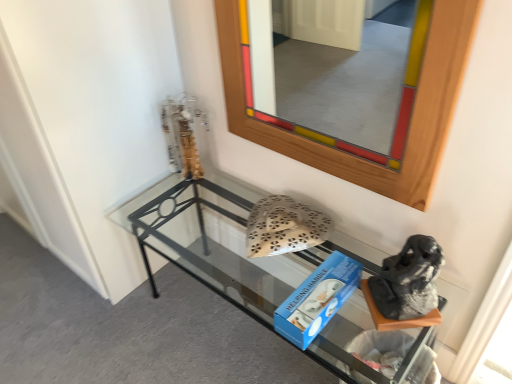
Question: Is gray fabric boot at lower right further to camera compared to clear glass shelf at lower center?

Choices:
 (A) yes
 (B) no

Answer: (A)

Question: Is gray fabric boot at lower right not close to clear glass shelf at lower center?

Choices:
 (A) yes
 (B) no

Answer: (B)

Question: Does gray fabric boot at lower right appear on the left side of clear glass shelf at lower center?

Choices:
 (A) no
 (B) yes

Answer: (A)

Question: Can you confirm if gray fabric boot at lower right is positioned to the right of clear glass shelf at lower center?

Choices:
 (A) yes
 (B) no

Answer: (A)

Question: From the image's perspective, is gray fabric boot at lower right below clear glass shelf at lower center?

Choices:
 (A) yes
 (B) no

Answer: (B)

Question: From a real-world perspective, is gray fabric boot at lower right positioned over clear glass shelf at lower center based on gravity?

Choices:
 (A) no
 (B) yes

Answer: (B)

Question: Is wooden frame at upper center positioned beyond the bounds of clear glass shelf at lower center?

Choices:
 (A) yes
 (B) no

Answer: (A)

Question: From the image's perspective, would you say wooden frame at upper center is positioned over clear glass shelf at lower center?

Choices:
 (A) no
 (B) yes

Answer: (B)

Question: Considering the relative sizes of wooden frame at upper center and clear glass shelf at lower center in the image provided, is wooden frame at upper center thinner than clear glass shelf at lower center?

Choices:
 (A) yes
 (B) no

Answer: (A)

Question: Considering the relative sizes of wooden frame at upper center and clear glass shelf at lower center in the image provided, is wooden frame at upper center shorter than clear glass shelf at lower center?

Choices:
 (A) no
 (B) yes

Answer: (A)

Question: Is wooden frame at upper center bigger than clear glass shelf at lower center?

Choices:
 (A) no
 (B) yes

Answer: (A)

Question: Is wooden frame at upper center smaller than clear glass shelf at lower center?

Choices:
 (A) no
 (B) yes

Answer: (B)

Question: Would you say gray fabric boot at lower right is a long distance from metallic gold sculpture at upper left?

Choices:
 (A) no
 (B) yes

Answer: (A)